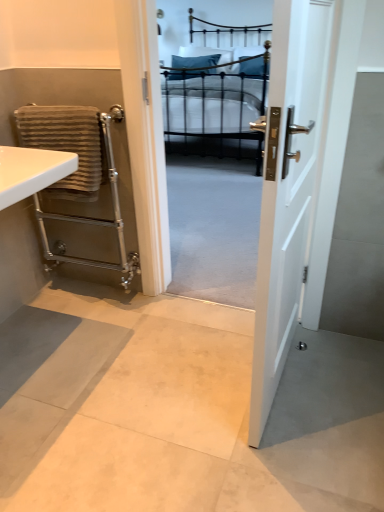
The height and width of the screenshot is (512, 384). What do you see at coordinates (67, 145) in the screenshot? I see `brown striped towel at left` at bounding box center [67, 145].

Find the location of a particular element. blue fabric pillow at center is located at coordinates (193, 66).

Which is more to the left, blue fabric pillow at center or white glossy sink at left?

From the viewer's perspective, white glossy sink at left appears more on the left side.

How many degrees apart are the facing directions of blue fabric pillow at center and white glossy sink at left?

The facing directions of blue fabric pillow at center and white glossy sink at left are 83.2 degrees apart.

From a real-world perspective, which is physically below, blue fabric pillow at center or white glossy sink at left?

white glossy sink at left is physically lower.

Would you say blue fabric pillow at center is outside white glossy sink at left?

Indeed, blue fabric pillow at center is completely outside white glossy sink at left.

Is brown striped towel at left positioned behind white glossy sink at left?

Yes, brown striped towel at left is further from the viewer.

Locate an element on the screen. The width and height of the screenshot is (384, 512). bath towel that is under the white glossy sink at left (from a real-world perspective) is located at coordinates (67, 145).

Are brown striped towel at left and white glossy sink at left located far from each other?

No, brown striped towel at left is not far from white glossy sink at left.

From the picture: Considering the sizes of blue fabric pillow at center and brown striped towel at left in the image, is blue fabric pillow at center bigger or smaller than brown striped towel at left?

blue fabric pillow at center is bigger than brown striped towel at left.

Is blue fabric pillow at center not near brown striped towel at left?

blue fabric pillow at center is positioned a significant distance from brown striped towel at left.

From the image's perspective, is blue fabric pillow at center on top of brown striped towel at left?

Yes, from the image's perspective, blue fabric pillow at center is above brown striped towel at left.

Looking at this image, from the image's perspective, would you say silver metallic towel rail at left is shown under black metal bed at center?

Yes, from the image's perspective, silver metallic towel rail at left is beneath black metal bed at center.

Is point (88, 155) closer or farther from the camera than point (179, 99)?

Point (88, 155) appears to be closer to the viewer than point (179, 99).

Consider the image. Is silver metallic towel rail at left oriented away from black metal bed at center?

Yes, silver metallic towel rail at left's orientation is away from black metal bed at center.

Is silver metallic towel rail at left at the left side of black metal bed at center?

Indeed, silver metallic towel rail at left is positioned on the left side of black metal bed at center.

Considering the sizes of brown striped towel at left and blue fabric pillow at center in the image, is brown striped towel at left bigger or smaller than blue fabric pillow at center?

Considering their sizes, brown striped towel at left takes up less space than blue fabric pillow at center.

In the image, there is a brown striped towel at left. Where is `pillow above it (from the image's perspective)`? The image size is (384, 512). pillow above it (from the image's perspective) is located at coordinates (193, 66).

Consider the image. From the image's perspective, is brown striped towel at left under blue fabric pillow at center?

Yes, from the image's perspective, brown striped towel at left is below blue fabric pillow at center.

Which of these two, brown striped towel at left or blue fabric pillow at center, is wider?

blue fabric pillow at center.

Locate an element on the screen. balustrade below the black metal bed at center (from a real-world perspective) is located at coordinates click(78, 173).

Considering the sizes of objects black metal bed at center and silver metallic towel rail at left in the image provided, who is bigger, black metal bed at center or silver metallic towel rail at left?

black metal bed at center.

How far apart are black metal bed at center and silver metallic towel rail at left?

black metal bed at center and silver metallic towel rail at left are 6.97 feet apart.

Is black metal bed at center inside the boundaries of silver metallic towel rail at left, or outside?

black metal bed at center is not inside silver metallic towel rail at left, it's outside.

This screenshot has height=512, width=384. I want to click on balustrade located on the right of brown striped towel at left, so click(x=78, y=173).

Considering the positions of objects silver metallic towel rail at left and brown striped towel at left in the image provided, who is behind, silver metallic towel rail at left or brown striped towel at left?

silver metallic towel rail at left is behind.

Would you say silver metallic towel rail at left is outside brown striped towel at left?

Yes, silver metallic towel rail at left is outside of brown striped towel at left.

Based on the photo, does silver metallic towel rail at left appear on the right side of brown striped towel at left?

Correct, you'll find silver metallic towel rail at left to the right of brown striped towel at left.

Identify the location of sink below the blue fabric pillow at center (from a real-world perspective). (31, 170).

Find the location of a particular element. The width and height of the screenshot is (384, 512). bath towel to the right of white glossy sink at left is located at coordinates (67, 145).

When comparing their distances from white glossy sink at left, does blue fabric pillow at center or white glossy door at center seem further?

Based on the image, blue fabric pillow at center appears to be further to white glossy sink at left.

Which object lies nearer to the anchor point white glossy door at center, blue fabric pillow at center or white glossy sink at left?

white glossy sink at left is positioned closer to the anchor white glossy door at center.

Estimate the real-world distances between objects in this image. Which object is closer to blue fabric pillow at center, brown striped towel at left or black metal bed at center?

black metal bed at center.

Considering their positions, is blue fabric pillow at center positioned further to black metal bed at center than white glossy sink at left?

Among the two, white glossy sink at left is located further to black metal bed at center.

Estimate the real-world distances between objects in this image. Which object is further from white glossy sink at left, black metal bed at center or white glossy door at center?

black metal bed at center lies further to white glossy sink at left than the other object.

Which object lies further to the anchor point white glossy sink at left, brown striped towel at left or silver metallic towel rail at left?

silver metallic towel rail at left.

From the image, which object appears to be nearer to white glossy door at center, black metal bed at center or silver metallic towel rail at left?

Based on the image, silver metallic towel rail at left appears to be nearer to white glossy door at center.

Based on their spatial positions, is black metal bed at center or brown striped towel at left further from white glossy sink at left?

black metal bed at center is positioned further to the anchor white glossy sink at left.

Where is `bed between white glossy door at center and blue fabric pillow at center from front to back`? The width and height of the screenshot is (384, 512). bed between white glossy door at center and blue fabric pillow at center from front to back is located at coordinates (215, 85).

Find the location of a particular element. balustrade between white glossy sink at left and black metal bed at center in the front-back direction is located at coordinates (78, 173).

You are a GUI agent. You are given a task and a screenshot of the screen. Output one action in this format:
    pyautogui.click(x=<x>, y=<y>)
    Task: Click on the sink between white glossy door at center and black metal bed at center in the front-back direction
    
    Given the screenshot: What is the action you would take?
    pyautogui.click(x=31, y=170)

I want to click on bath towel located between white glossy sink at left and white glossy door at center in the left-right direction, so click(x=67, y=145).